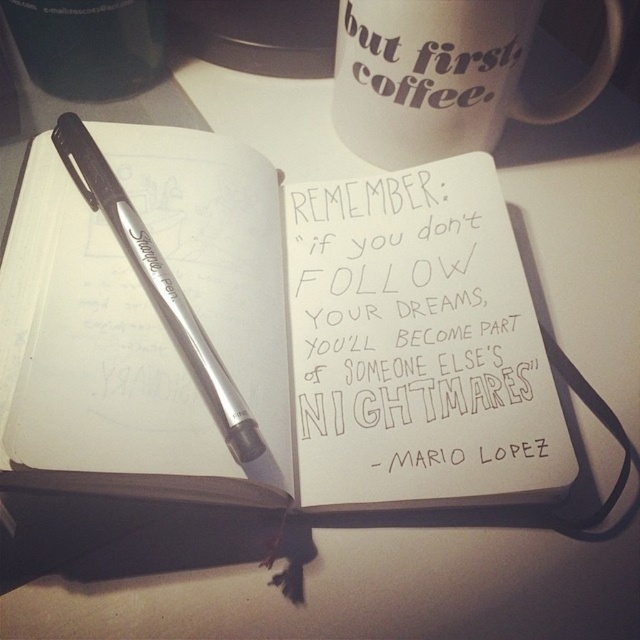
Question: Observing the image, what is the correct spatial positioning of white matte mug at upper center in reference to metallic silver pen at upper left?

Choices:
 (A) above
 (B) below

Answer: (A)

Question: Does white handwritten text at center have a smaller size compared to white matte mug at upper center?

Choices:
 (A) yes
 (B) no

Answer: (B)

Question: Which point appears farthest from the camera in this image?

Choices:
 (A) (406, 147)
 (B) (147, 280)
 (C) (420, 428)

Answer: (A)

Question: From the image, what is the correct spatial relationship of white handwritten text at center in relation to white matte mug at upper center?

Choices:
 (A) below
 (B) above

Answer: (A)

Question: Which object is the farthest from the white handwritten text at center?

Choices:
 (A) metallic silver pen at upper left
 (B) white matte mug at upper center

Answer: (A)

Question: Based on their relative distances, which object is nearer to the white matte mug at upper center?

Choices:
 (A) metallic silver pen at upper left
 (B) white handwritten text at center

Answer: (B)